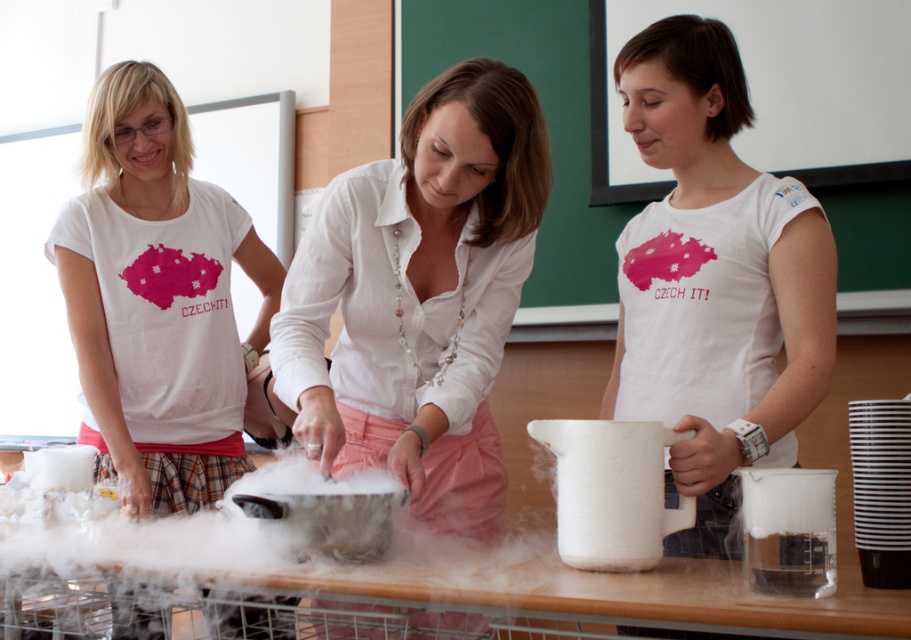
Question: Can you confirm if white matte t-shirt at center is positioned below matte white shirt at center?

Choices:
 (A) no
 (B) yes

Answer: (A)

Question: Among these points, which one is nearest to the camera?

Choices:
 (A) (801, 240)
 (B) (494, 300)

Answer: (A)

Question: Can you confirm if white linen shirt at center is positioned below white matte t-shirt at center?

Choices:
 (A) yes
 (B) no

Answer: (A)

Question: Is white linen shirt at center closer to the viewer compared to white matte t-shirt at center?

Choices:
 (A) no
 (B) yes

Answer: (B)

Question: Which point appears farthest from the camera in this image?

Choices:
 (A) (474, 269)
 (B) (165, 401)
 (C) (769, 444)

Answer: (B)

Question: Which object is positioned closest to the white linen shirt at center?

Choices:
 (A) white matte t-shirt at center
 (B) matte white shirt at center

Answer: (A)